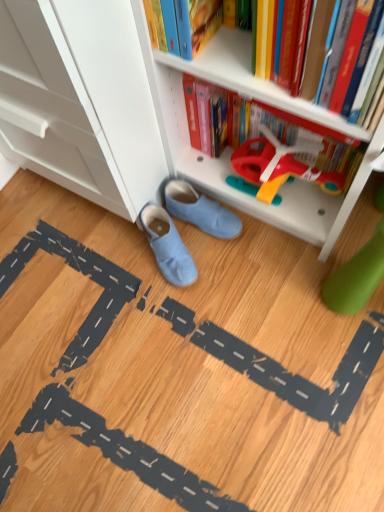
Locate an element on the screen. Image resolution: width=384 pixels, height=512 pixels. free space to the left of white plastic bookcase at lower center is located at coordinates pos(137,268).